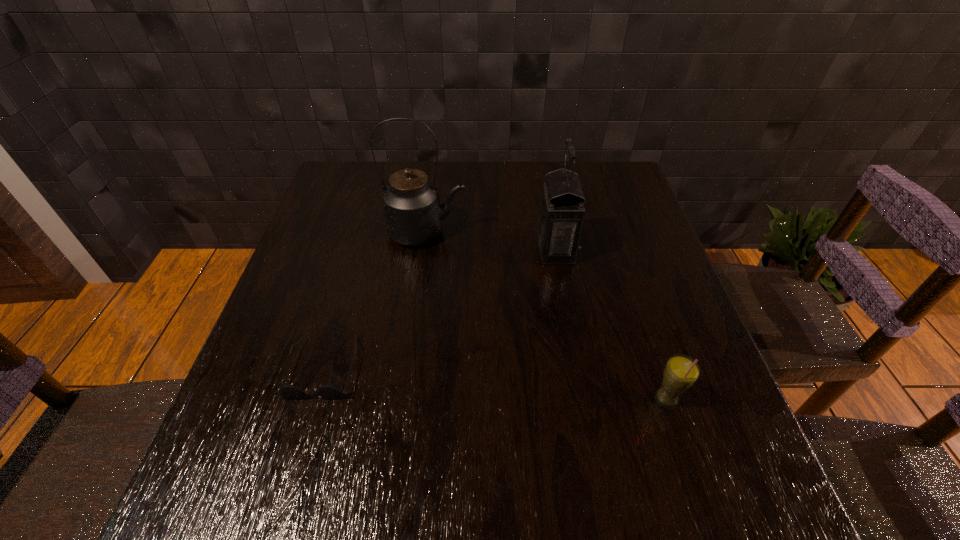
What are the coordinates of `free location located on the front-facing side of the shortest object` in the screenshot? It's located at (296, 459).

Find the location of a particular element. object that is at the left edge is located at coordinates (331, 391).

You are a GUI agent. You are given a task and a screenshot of the screen. Output one action in this format:
    pyautogui.click(x=<x>, y=<y>)
    Task: Click on the object that is at the right edge
    The image size is (960, 540).
    Given the screenshot: What is the action you would take?
    pyautogui.click(x=681, y=372)

Identify the location of free point at the far edge. The height and width of the screenshot is (540, 960). (514, 163).

In the image, there is a desktop. At what (x,y) coordinates should I click in order to perform the action: click on vacant space at the near edge. Please return your answer as a coordinate pair (x, y). Looking at the image, I should click on (584, 480).

In the image, there is a desktop. At what (x,y) coordinates should I click in order to perform the action: click on vacant space at the left edge. Please return your answer as a coordinate pair (x, y). Looking at the image, I should click on (298, 358).

Find the location of `free space at the right edge of the desktop`. free space at the right edge of the desktop is located at coordinates (666, 357).

In the image, there is a desktop. At what (x,y) coordinates should I click in order to perform the action: click on vacant space at the far left corner. Please return your answer as a coordinate pair (x, y). Looking at the image, I should click on (366, 171).

Locate an element on the screen. This screenshot has height=540, width=960. free spot between the second shortest object and the kettle is located at coordinates (546, 316).

Locate an element on the screen. The image size is (960, 540). vacant space that's between the rightmost object and the kettle is located at coordinates (546, 316).